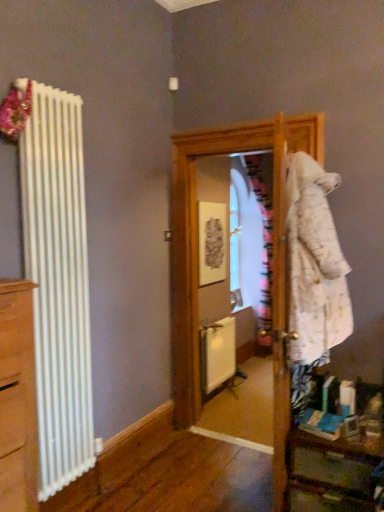
Question: Should I look upward or downward to see wooden table at lower right?

Choices:
 (A) down
 (B) up

Answer: (A)